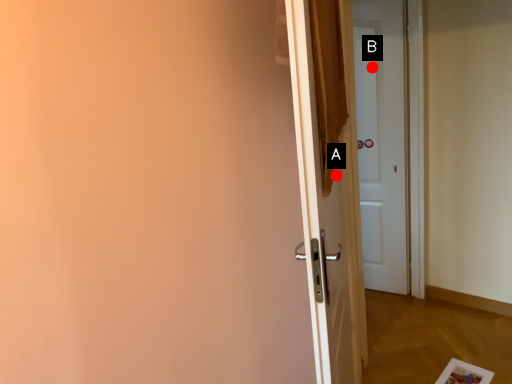
Question: Two points are circled on the image, labeled by A and B beside each circle. Which point appears farthest from the camera in this image?

Choices:
 (A) A is further
 (B) B is further

Answer: (B)